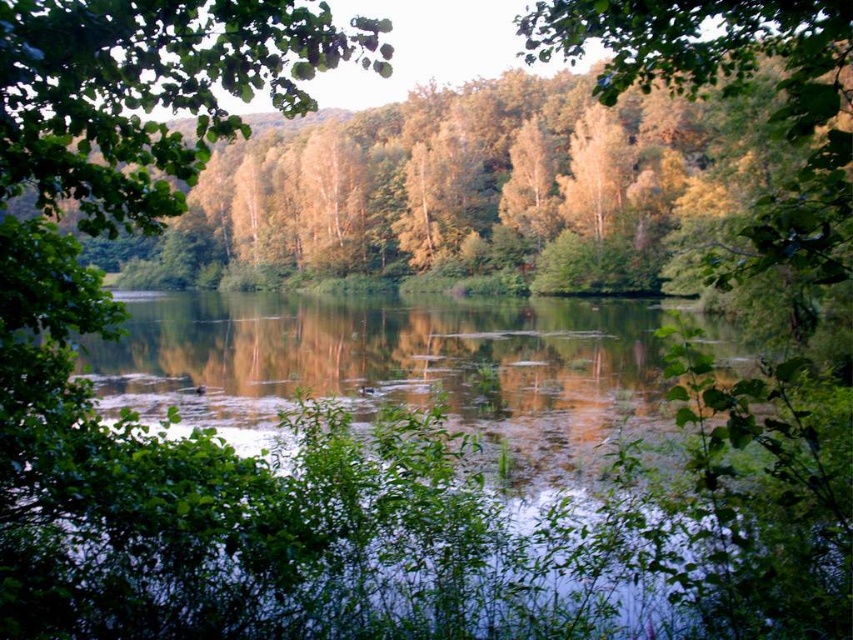
You are an artist trying to paint the scene. You need to decide which object, the green reflective water at center or the green leafy tree at upper left, requires more horizontal space in your canvas. Based on the scene, which one should you allocate more width to?

The green leafy tree at upper left requires more horizontal space because it is wider than the green reflective water at center.

You are standing in the serene natural scene and want to take a photo of the green leafy tree at upper left and the green reflective water at center. Which object should you point your camera at first if you want to capture both in one frame?

You should point your camera at the green leafy tree at upper left first because it is above the green reflective water at center, so capturing it first ensures both are in the frame.

You are an artist sketching the scene. You notice the green reflective water at center and the green leafy tree at upper left. Which object is closer to the bottom edge of your paper?

The green reflective water at center is closer to the bottom edge of the paper because it is shorter than the green leafy tree at upper left, meaning it occupies a lower position in the scene.